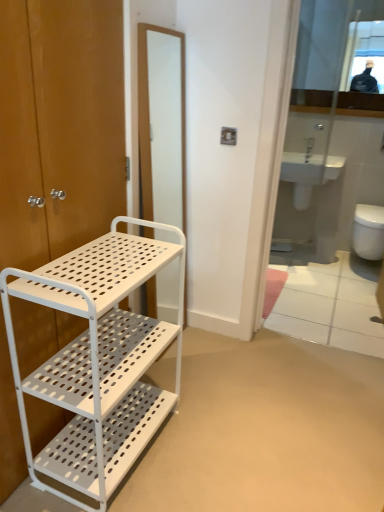
Where is `unoccupied region to the right of white matte screen door at center`? The height and width of the screenshot is (512, 384). unoccupied region to the right of white matte screen door at center is located at coordinates (207, 349).